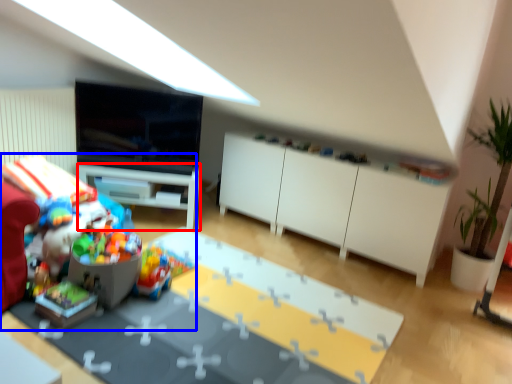
Question: Among these objects, which one is farthest to the camera, desk (highlighted by a red box) or toy (highlighted by a blue box)?

Choices:
 (A) desk
 (B) toy

Answer: (A)